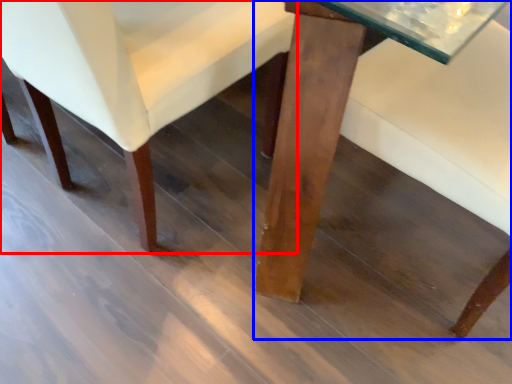
Question: Which point is further to the camera, chair (highlighted by a red box) or table (highlighted by a blue box)?

Choices:
 (A) chair
 (B) table

Answer: (A)